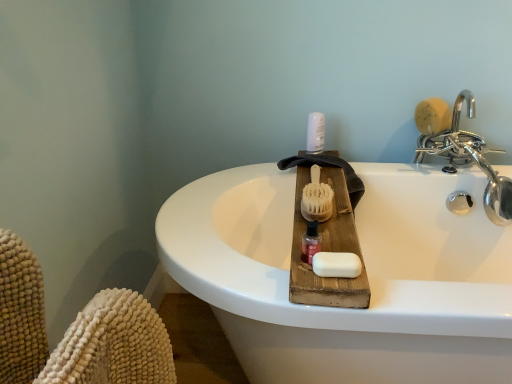
The height and width of the screenshot is (384, 512). What are the coordinates of `vacant space behind pink glossy bottle at center` in the screenshot? It's located at (323, 220).